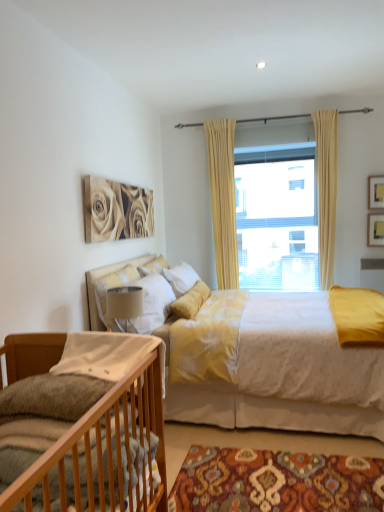
Question: From a real-world perspective, is yellow fabric curtain at center, which is the second curtain from right to left, positioned over beige fabric curtain at upper center, acting as the 2th curtain starting from the left, based on gravity?

Choices:
 (A) yes
 (B) no

Answer: (B)

Question: Does yellow fabric curtain at center, which appears as the 1th curtain when viewed from the left, have a larger size compared to beige fabric curtain at upper center, the 1th curtain viewed from the right?

Choices:
 (A) no
 (B) yes

Answer: (A)

Question: Is yellow fabric curtain at center, which appears as the 1th curtain when viewed from the left, to the right of beige fabric curtain at upper center, acting as the 2th curtain starting from the left, from the viewer's perspective?

Choices:
 (A) no
 (B) yes

Answer: (A)

Question: Is yellow fabric curtain at center, which is the second curtain from right to left, wider than beige fabric curtain at upper center, the 1th curtain viewed from the right?

Choices:
 (A) yes
 (B) no

Answer: (B)

Question: Does yellow fabric curtain at center, which is the second curtain from right to left, have a greater height compared to beige fabric curtain at upper center, acting as the 2th curtain starting from the left?

Choices:
 (A) yes
 (B) no

Answer: (A)

Question: Considering the positions of wooden picture frame at upper right, which is counted as the 1th picture frame, starting from the bottom, and beige fabric curtain at upper center, acting as the 2th curtain starting from the left, in the image, is wooden picture frame at upper right, which is counted as the 1th picture frame, starting from the bottom, bigger or smaller than beige fabric curtain at upper center, acting as the 2th curtain starting from the left,?

Choices:
 (A) big
 (B) small

Answer: (B)

Question: From a real-world perspective, is wooden picture frame at upper right, which is counted as the 1th picture frame, starting from the bottom, physically located above or below beige fabric curtain at upper center, acting as the 2th curtain starting from the left?

Choices:
 (A) above
 (B) below

Answer: (B)

Question: From the image's perspective, is wooden picture frame at upper right, the 2th picture frame when ordered from top to bottom, above or below beige fabric curtain at upper center, the 1th curtain viewed from the right?

Choices:
 (A) above
 (B) below

Answer: (B)

Question: Looking at their shapes, would you say wooden picture frame at upper right, which is counted as the 1th picture frame, starting from the bottom, is wider or thinner than beige fabric curtain at upper center, the 1th curtain viewed from the right?

Choices:
 (A) thin
 (B) wide

Answer: (A)

Question: Considering the relative positions of wooden picture frame at upper right, which is counted as the 1th picture frame, starting from the bottom, and white soft pillow at upper center, the 1th pillow in the back-to-front sequence, in the image provided, is wooden picture frame at upper right, which is counted as the 1th picture frame, starting from the bottom, to the left or to the right of white soft pillow at upper center, the 1th pillow in the back-to-front sequence,?

Choices:
 (A) left
 (B) right

Answer: (B)

Question: From the image's perspective, is wooden picture frame at upper right, the 2th picture frame when ordered from top to bottom, above or below white soft pillow at upper center, the 1th pillow in the back-to-front sequence?

Choices:
 (A) below
 (B) above

Answer: (B)

Question: Considering the positions of wooden picture frame at upper right, the 2th picture frame when ordered from top to bottom, and white soft pillow at upper center, the 1th pillow in the back-to-front sequence, in the image, is wooden picture frame at upper right, the 2th picture frame when ordered from top to bottom, wider or thinner than white soft pillow at upper center, the 1th pillow in the back-to-front sequence,?

Choices:
 (A) wide
 (B) thin

Answer: (B)

Question: Looking at the image, does wooden picture frame at upper right, the 2th picture frame when ordered from top to bottom, seem bigger or smaller compared to white soft pillow at upper center, the 1th pillow in the back-to-front sequence?

Choices:
 (A) small
 (B) big

Answer: (A)

Question: Considering the positions of wooden crib at lower left, which is the 1th bed in front-to-back order, and wooden picture frame at upper right, which is counted as the 1th picture frame, starting from the bottom, in the image, is wooden crib at lower left, which is the 1th bed in front-to-back order, taller or shorter than wooden picture frame at upper right, which is counted as the 1th picture frame, starting from the bottom,?

Choices:
 (A) short
 (B) tall

Answer: (B)

Question: From the image's perspective, relative to wooden picture frame at upper right, the 2th picture frame when ordered from top to bottom, is wooden crib at lower left, which is the second bed in back-to-front order, above or below?

Choices:
 (A) above
 (B) below

Answer: (B)